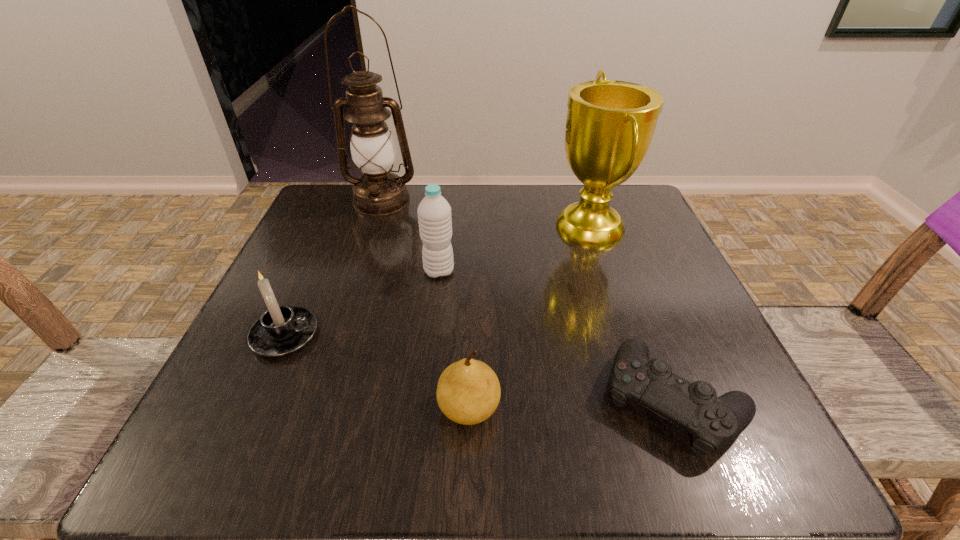
Locate an element on the screen. the tallest object is located at coordinates (379, 192).

Where is `award`? award is located at coordinates (610, 124).

Find the location of a particular element. the fourth shortest object is located at coordinates (434, 212).

This screenshot has width=960, height=540. I want to click on candle holder, so click(282, 330).

Identify the location of pear. Image resolution: width=960 pixels, height=540 pixels. (468, 392).

Locate an element on the screen. Image resolution: width=960 pixels, height=540 pixels. the shortest object is located at coordinates (714, 422).

Where is `vacant space located on the right of the oil lamp`? The width and height of the screenshot is (960, 540). vacant space located on the right of the oil lamp is located at coordinates (567, 200).

I want to click on blank area located on the shiny surface of the fifth shortest object, so click(439, 228).

Locate an element on the screen. free space located on the shiny surface of the fifth shortest object is located at coordinates (497, 228).

Where is `free space located on the shiny surface of the fifth shortest object`? The width and height of the screenshot is (960, 540). free space located on the shiny surface of the fifth shortest object is located at coordinates (434, 228).